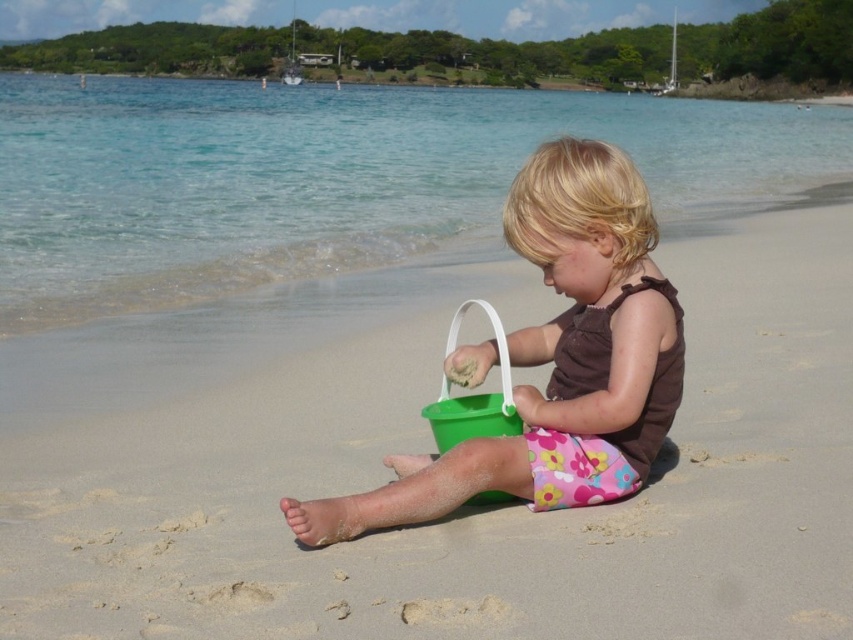
You are standing on the beach and see two points marked in the scene. Which point is closer to you, point (x=231, y=630) or point (x=560, y=384)?

Point (x=231, y=630) is closer to you than point (x=560, y=384).

You are standing on the beach and want to throw a seashell into the clear blue water at upper center. If you can throw a seashell 6 meters, will it reach the water?

The clear blue water at upper center is 6.21 meters away from you. Since your throw can only reach 6 meters, the seashell won

You are standing at point (438, 476) on the beach and want to walk to the water. There is a point at (0, 129) behind you. Which direction should you walk to avoid the point behind you?

You should walk towards the water in the direction away from point (0, 129) since it is behind you.